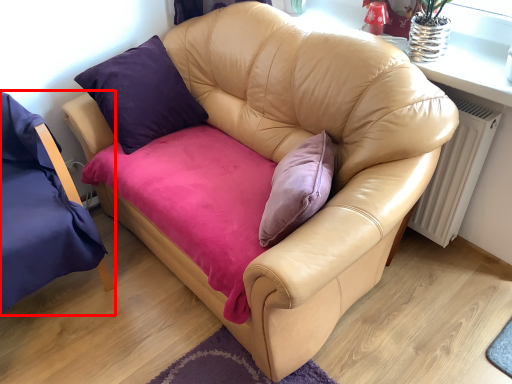
Question: From the image's perspective, where is chair (annotated by the red box) located relative to radiator?

Choices:
 (A) above
 (B) below

Answer: (B)